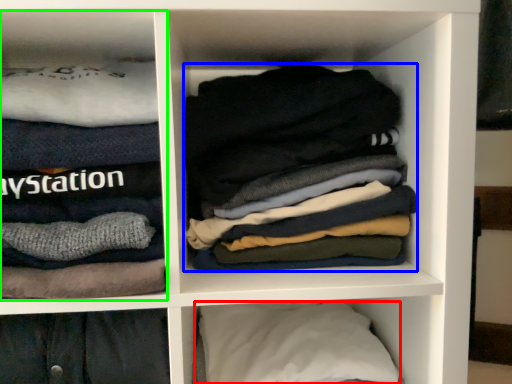
Question: Estimate the real-world distances between objects in this image. Which object is closer to pillow (highlighted by a red box), laundry (highlighted by a blue box) or cabinet (highlighted by a green box)?

Choices:
 (A) laundry
 (B) cabinet

Answer: (A)